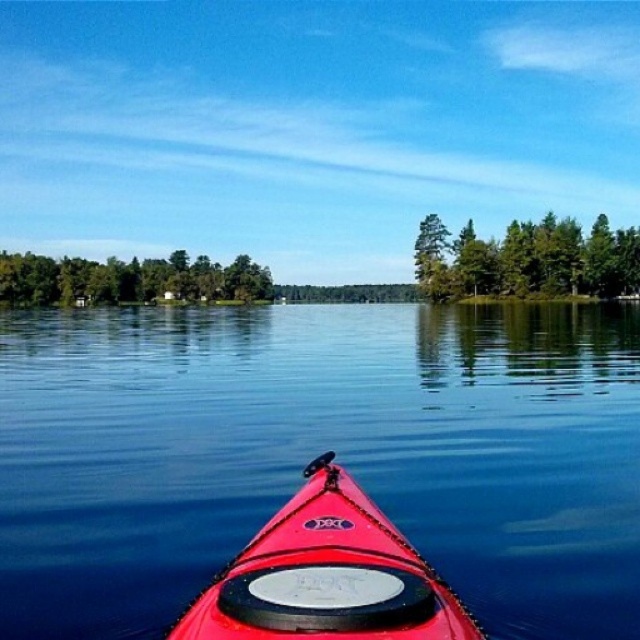
Question: Is green textured trees at upper center above green leafy trees at center?

Choices:
 (A) no
 (B) yes

Answer: (A)

Question: Among these objects, which one is farthest from the camera?

Choices:
 (A) shiny red kayak at center
 (B) green leafy trees at center

Answer: (B)

Question: Which object is positioned farthest from the shiny red kayak at center?

Choices:
 (A) transparent blue water at center
 (B) green leafy trees at center
 (C) green textured trees at upper center

Answer: (B)

Question: Can you confirm if transparent blue water at center is positioned to the right of green leafy trees at center?

Choices:
 (A) yes
 (B) no

Answer: (A)

Question: Does transparent blue water at center appear over green textured trees at upper center?

Choices:
 (A) yes
 (B) no

Answer: (B)

Question: Among these points, which one is nearest to the camera?

Choices:
 (A) (56, 280)
 (B) (342, 476)
 (C) (419, 234)

Answer: (B)